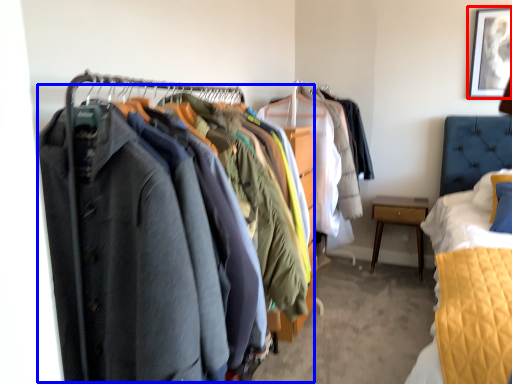
Question: Among these objects, which one is farthest to the camera, picture frame (highlighted by a red box) or closet (highlighted by a blue box)?

Choices:
 (A) picture frame
 (B) closet

Answer: (A)